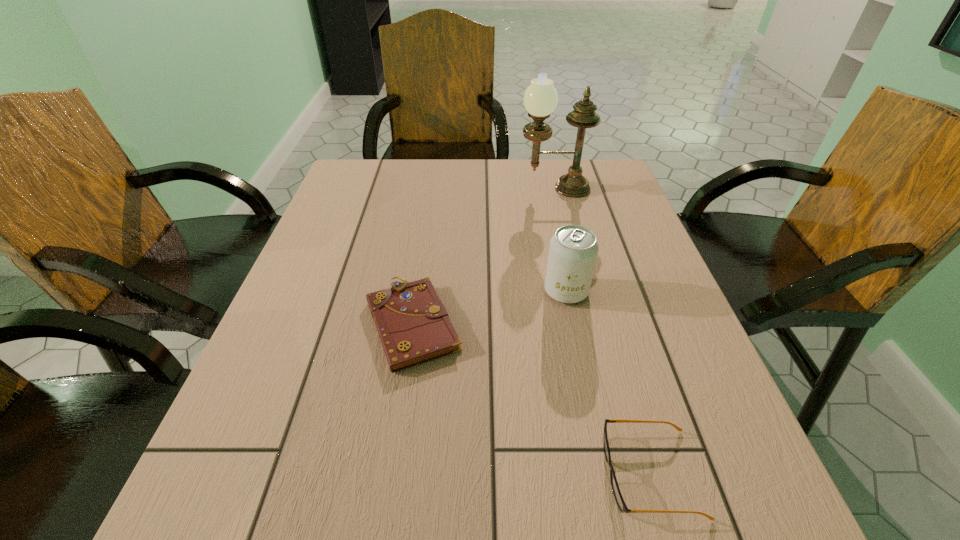
Find the location of a particular element. The image size is (960, 540). vacant space that is in between the second tallest object and the leftmost object is located at coordinates (490, 307).

The width and height of the screenshot is (960, 540). Identify the location of free space between the leftmost object and the nearest object. [532, 398].

Point out which object is positioned as the third nearest to the tallest object. Please provide its 2D coordinates. Your answer should be formatted as a tuple, i.e. [(x, y)], where the tuple contains the x and y coordinates of a point satisfying the conditions above.

[(619, 499)]

Identify which object is located as the nearest to the tallest object. Please provide its 2D coordinates. Your answer should be formatted as a tuple, i.e. [(x, y)], where the tuple contains the x and y coordinates of a point satisfying the conditions above.

[(573, 250)]